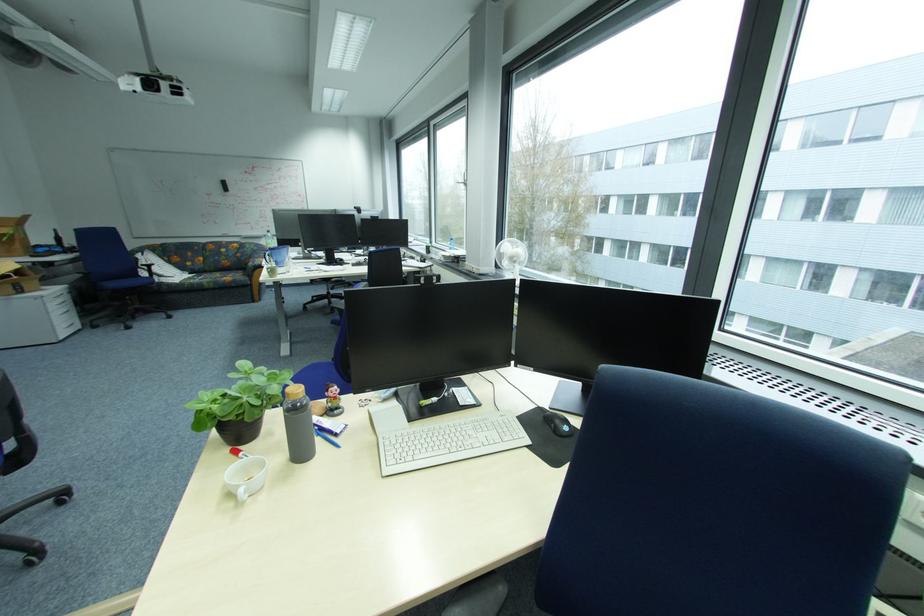
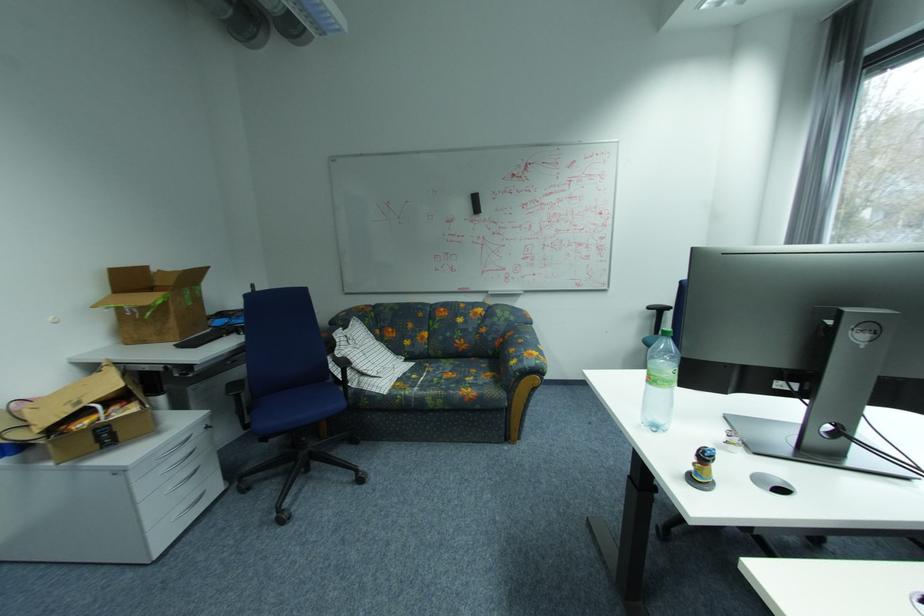
Where in the second image is the point corresponding to (27,246) from the first image?

(180, 323)